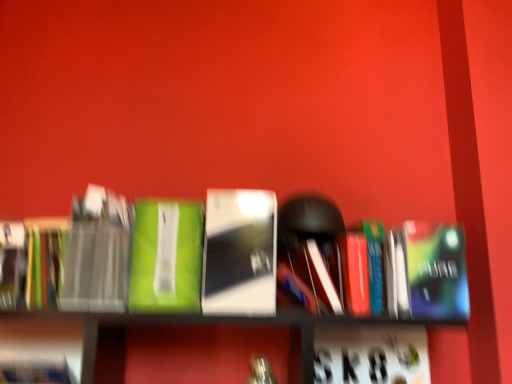
Question: Considering the relative sizes of multicolored paper at left, which appears as the 3th paperback book when viewed from the right, and matte black book at left, which ranks as the 3th paperback book in left-to-right order, in the image provided, is multicolored paper at left, which appears as the 3th paperback book when viewed from the right, thinner than matte black book at left, which ranks as the 3th paperback book in left-to-right order,?

Choices:
 (A) no
 (B) yes

Answer: (B)

Question: Is the depth of multicolored paper at left, which appears as the 3th paperback book when viewed from the right, greater than that of matte black book at left, the second paperback book positioned from the right?

Choices:
 (A) yes
 (B) no

Answer: (A)

Question: Is multicolored paper at left, which appears as the 3th paperback book when viewed from the right, outside of matte black book at left, which ranks as the 3th paperback book in left-to-right order?

Choices:
 (A) yes
 (B) no

Answer: (A)

Question: Is multicolored paper at left, the 2th paperback book in the left-to-right sequence, at the right side of matte black book at left, which ranks as the 3th paperback book in left-to-right order?

Choices:
 (A) yes
 (B) no

Answer: (B)

Question: Could you tell me if multicolored paper at left, which appears as the 3th paperback book when viewed from the right, is turned towards matte black book at left, the second paperback book positioned from the right?

Choices:
 (A) no
 (B) yes

Answer: (A)

Question: Considering the relative positions of hardcover book at left, the 4th paperback book from the right, and metallic blue paperback book at center right, placed as the 1th paperback book when sorted from right to left, in the image provided, is hardcover book at left, the 4th paperback book from the right, to the left or to the right of metallic blue paperback book at center right, placed as the 1th paperback book when sorted from right to left,?

Choices:
 (A) right
 (B) left

Answer: (B)

Question: In the image, is hardcover book at left, the 4th paperback book from the right, positioned in front of or behind metallic blue paperback book at center right, placed as the 1th paperback book when sorted from right to left?

Choices:
 (A) behind
 (B) front

Answer: (A)

Question: From the image's perspective, relative to metallic blue paperback book at center right, which is counted as the 4th paperback book, starting from the left, is hardcover book at left, the 4th paperback book from the right, above or below?

Choices:
 (A) above
 (B) below

Answer: (A)

Question: Is hardcover book at left, the 1th paperback book viewed from the left, wider or thinner than metallic blue paperback book at center right, placed as the 1th paperback book when sorted from right to left?

Choices:
 (A) thin
 (B) wide

Answer: (A)

Question: In terms of width, does metallic silver book at center, placed as the 1th book when sorted from right to left, look wider or thinner when compared to matte black book at left, the second paperback book positioned from the right?

Choices:
 (A) wide
 (B) thin

Answer: (A)

Question: Relative to matte black book at left, which ranks as the 3th paperback book in left-to-right order, is metallic silver book at center, the second book from the left, in front or behind?

Choices:
 (A) front
 (B) behind

Answer: (B)

Question: In terms of height, does metallic silver book at center, the second book from the left, look taller or shorter compared to matte black book at left, the second paperback book positioned from the right?

Choices:
 (A) tall
 (B) short

Answer: (A)

Question: In terms of size, does metallic silver book at center, the second book from the left, appear bigger or smaller than matte black book at left, which ranks as the 3th paperback book in left-to-right order?

Choices:
 (A) big
 (B) small

Answer: (A)

Question: Does point (91, 284) appear closer or farther from the camera than point (264, 274)?

Choices:
 (A) farther
 (B) closer

Answer: (A)

Question: In terms of height, does matte black book at left, which ranks as the 3th paperback book in left-to-right order, look taller or shorter compared to metallic silver book at center, the second book from the left?

Choices:
 (A) tall
 (B) short

Answer: (B)